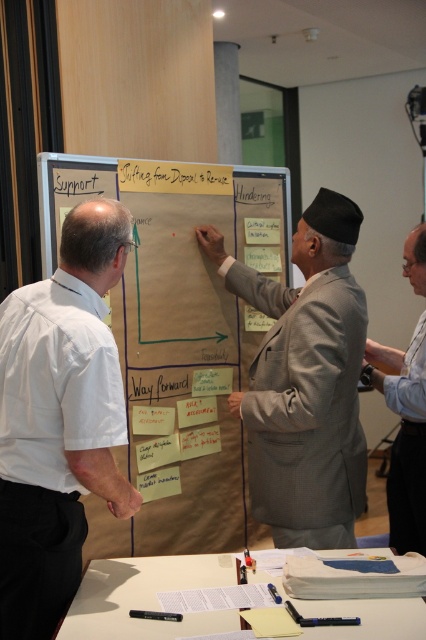
Can you confirm if beige paperboard at center is positioned above white shirt at left?

Yes, beige paperboard at center is above white shirt at left.

Between point (249, 205) and point (54, 528), which one is positioned in front?

Point (54, 528)

Is point (135, 216) behind point (83, 205)?

Yes, it is.

At what (x,y) coordinates should I click in order to perform the action: click on beige paperboard at center. Please return your answer as a coordinate pair (x, y). The image size is (426, 640). Looking at the image, I should click on (176, 333).

Which of these two, gray suit at right or white paper at center, stands taller?

gray suit at right is taller.

Measure the distance between gray suit at right and camera.

A distance of 2.25 meters exists between gray suit at right and camera.

The height and width of the screenshot is (640, 426). Identify the location of gray suit at right. (403, 435).

Can you confirm if white shirt at left is positioned to the left of white paper at lower center?

Yes, white shirt at left is to the left of white paper at lower center.

You are a GUI agent. You are given a task and a screenshot of the screen. Output one action in this format:
    pyautogui.click(x=<x>, y=<y>)
    Task: Click on the white shirt at left
    
    Given the screenshot: What is the action you would take?
    pyautogui.click(x=58, y=419)

At what (x,y) coordinates should I click in order to perform the action: click on white shirt at left. Please return your answer as a coordinate pair (x, y). Looking at the image, I should click on coord(58,419).